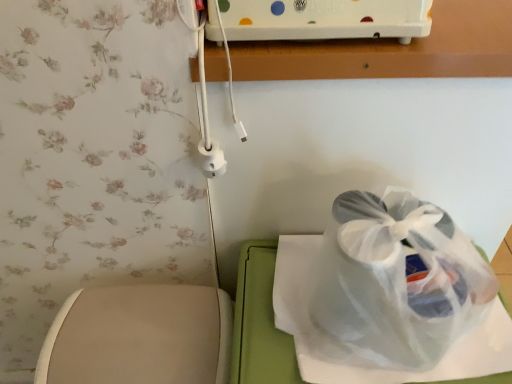
Looking at this image, measure the distance between transparent plastic bag at center and camera.

The depth of transparent plastic bag at center is 17.48 inches.

Where is `transparent plastic bag at center`? The width and height of the screenshot is (512, 384). transparent plastic bag at center is located at coordinates (391, 284).

The width and height of the screenshot is (512, 384). Describe the element at coordinates (391, 284) in the screenshot. I see `transparent plastic bag at center` at that location.

Locate an element on the screen. Image resolution: width=512 pixels, height=384 pixels. beige fabric toilet at lower left is located at coordinates (139, 336).

Describe the element at coordinates (139, 336) in the screenshot. I see `beige fabric toilet at lower left` at that location.

Locate an element on the screen. This screenshot has height=384, width=512. transparent plastic bag at center is located at coordinates (391, 284).

Can you confirm if beige fabric toilet at lower left is positioned to the right of transparent plastic bag at center?

In fact, beige fabric toilet at lower left is to the left of transparent plastic bag at center.

Is beige fabric toilet at lower left behind transparent plastic bag at center?

Yes, it is behind transparent plastic bag at center.

Which is in front, point (87, 323) or point (434, 337)?

The point (434, 337) is more forward.

From the image's perspective, is beige fabric toilet at lower left located above transparent plastic bag at center?

No.

From a real-world perspective, which is physically below, beige fabric toilet at lower left or transparent plastic bag at center?

beige fabric toilet at lower left.

Between beige fabric toilet at lower left and transparent plastic bag at center, which one has larger width?

transparent plastic bag at center is wider.

Is beige fabric toilet at lower left taller than transparent plastic bag at center?

Yes, beige fabric toilet at lower left is taller than transparent plastic bag at center.

Considering the relative sizes of beige fabric toilet at lower left and transparent plastic bag at center in the image provided, is beige fabric toilet at lower left smaller than transparent plastic bag at center?

No.

Can we say beige fabric toilet at lower left lies outside transparent plastic bag at center?

Indeed, beige fabric toilet at lower left is completely outside transparent plastic bag at center.

Are beige fabric toilet at lower left and transparent plastic bag at center located far from each other?

beige fabric toilet at lower left is actually quite close to transparent plastic bag at center.

Could you tell me if beige fabric toilet at lower left is facing transparent plastic bag at center?

No, beige fabric toilet at lower left is not facing towards transparent plastic bag at center.

Where is `plastic bag in front of the beige fabric toilet at lower left`? The image size is (512, 384). plastic bag in front of the beige fabric toilet at lower left is located at coordinates (391, 284).

Can you confirm if transparent plastic bag at center is positioned to the left of beige fabric toilet at lower left?

Incorrect, transparent plastic bag at center is not on the left side of beige fabric toilet at lower left.

Which object is closer to the camera, transparent plastic bag at center or beige fabric toilet at lower left?

Positioned in front is transparent plastic bag at center.

Which point is more forward, (390, 241) or (95, 293)?

Point (390, 241)

From the image's perspective, is transparent plastic bag at center over beige fabric toilet at lower left?

Yes, from the image's perspective, transparent plastic bag at center is over beige fabric toilet at lower left.

From a real-world perspective, is transparent plastic bag at center above or below beige fabric toilet at lower left?

transparent plastic bag at center is situated higher than beige fabric toilet at lower left in the real world.

Considering the sizes of transparent plastic bag at center and beige fabric toilet at lower left in the image, is transparent plastic bag at center wider or thinner than beige fabric toilet at lower left?

In the image, transparent plastic bag at center appears to be wider than beige fabric toilet at lower left.

Considering the relative sizes of transparent plastic bag at center and beige fabric toilet at lower left in the image provided, is transparent plastic bag at center shorter than beige fabric toilet at lower left?

Indeed, transparent plastic bag at center has a lesser height compared to beige fabric toilet at lower left.

Can you confirm if transparent plastic bag at center is bigger than beige fabric toilet at lower left?

Actually, transparent plastic bag at center might be smaller than beige fabric toilet at lower left.

Would you say transparent plastic bag at center is outside beige fabric toilet at lower left?

Yes.

Is transparent plastic bag at center directly adjacent to beige fabric toilet at lower left?

No, transparent plastic bag at center is not touching beige fabric toilet at lower left.

Could you tell me if transparent plastic bag at center is facing beige fabric toilet at lower left?

No, transparent plastic bag at center is not oriented towards beige fabric toilet at lower left.

How many degrees apart are the facing directions of transparent plastic bag at center and beige fabric toilet at lower left?

The angular difference between transparent plastic bag at center and beige fabric toilet at lower left is 0.000453 degrees.

Measure the distance from transparent plastic bag at center to beige fabric toilet at lower left.

transparent plastic bag at center and beige fabric toilet at lower left are 26.91 centimeters apart.

I want to click on plastic bag to the right of beige fabric toilet at lower left, so click(391, 284).

In order to click on toilet behind the transparent plastic bag at center in this screenshot , I will do `click(139, 336)`.

I want to click on plastic bag that appears in front of the beige fabric toilet at lower left, so click(391, 284).